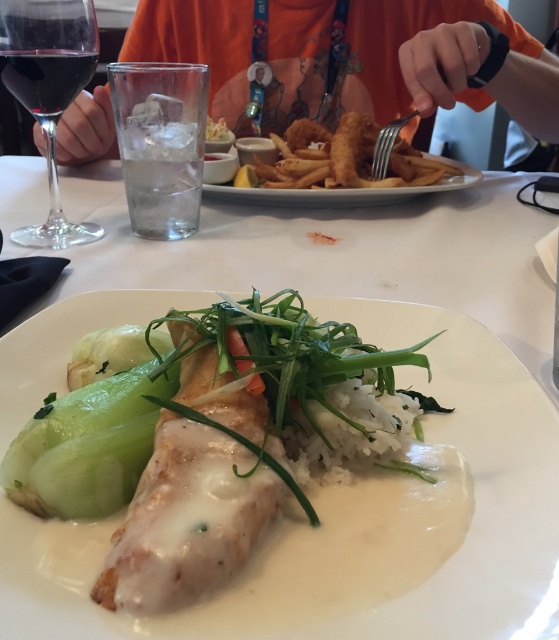
Question: Can you confirm if transparent glass at upper left is positioned below dark red glass at upper left?

Choices:
 (A) yes
 (B) no

Answer: (A)

Question: Is transparent glass at upper left positioned in front of golden crispy fries at center?

Choices:
 (A) yes
 (B) no

Answer: (A)

Question: Which point is closer to the camera?

Choices:
 (A) (83, 99)
 (B) (151, 620)
 (C) (381, 144)

Answer: (B)

Question: Among these points, which one is nearest to the camera?

Choices:
 (A) (41, 0)
 (B) (40, 60)
 (C) (383, 148)

Answer: (A)

Question: Estimate the real-world distances between objects in this image. Which object is farther from the transparent glass at upper left?

Choices:
 (A) silver metallic fork at upper center
 (B) golden crispy fries at center
 (C) orange cotton shirt at upper center
 (D) white creamy sauce at center

Answer: (C)

Question: In this image, where is orange cotton shirt at upper center located relative to dark red glass at upper left?

Choices:
 (A) right
 (B) left

Answer: (A)